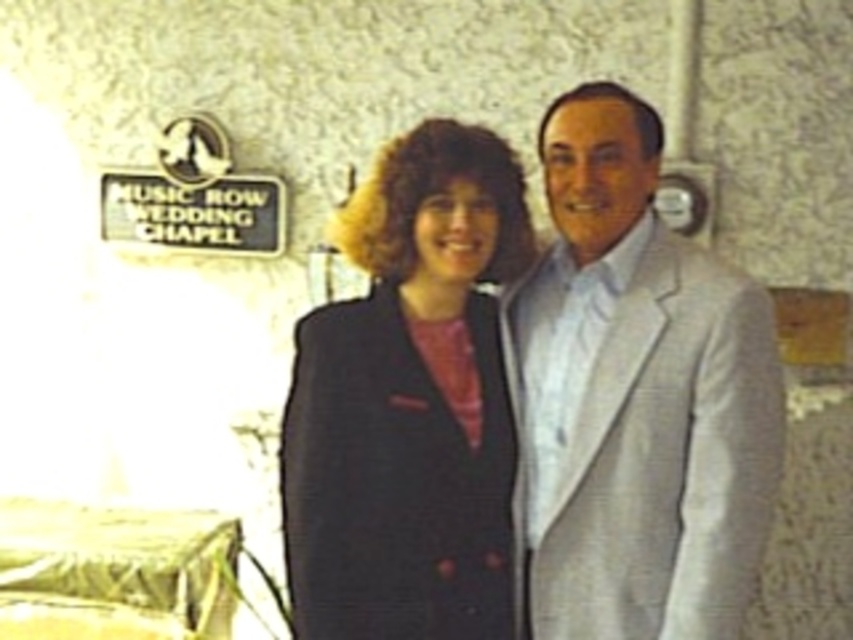
You are a photographer at the MUSIC ROW WEDDING CHAPEL and need to position the two guests so that the light gray textured suit at center is to the left of the matte black blazer at center. Based on their current positions, is this adjustment necessary?

Yes, the light gray textured suit at center is currently to the right of the matte black blazer at center, so the photographer needs to adjust their positions to swap places so the light gray textured suit at center is on the left side of the matte black blazer at center.

You are a photographer at the MUSIC ROW WEDDING CHAPEL. You need to adjust the lighting to ensure the light gray textured suit at center is properly illuminated. Where should you position the light source relative to the point marked by the coordinate point (636,397)?

The light gray textured suit at center is represented by point (636,397), so you should position the light source directly above or in front of this point to ensure proper illumination.

You are a photographer at the MUSIC ROW WEDDING CHAPEL and need to ensure the two subjects wearing the light gray textured suit at center and the matte black blazer at center are positioned for a group photo. The minimum required distance between them for proper framing is 20 centimeters. Can they maintain the required distance based on their current positions?

The distance between the light gray textured suit at center and the matte black blazer at center is 19.82 centimeters, which is slightly less than the required 20 centimeters. They need to move about 0.18 centimeters apart to meet the minimum distance requirement.